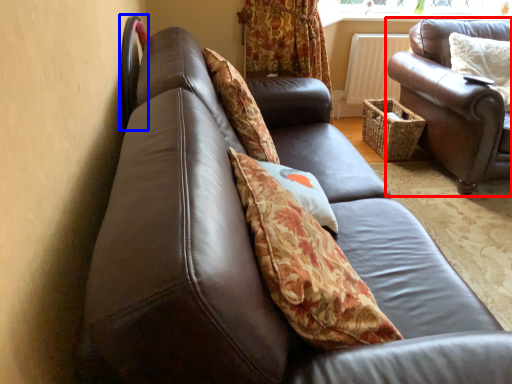
Question: Which point is further to the camera, studio couch (highlighted by a red box) or chair (highlighted by a blue box)?

Choices:
 (A) studio couch
 (B) chair

Answer: (A)